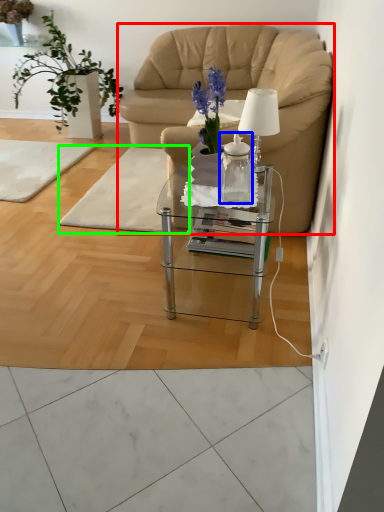
Question: Based on their relative distances, which object is nearer to chair (highlighted by a red box)? Choose from vase (highlighted by a blue box) and mat (highlighted by a green box).

Choices:
 (A) vase
 (B) mat

Answer: (B)